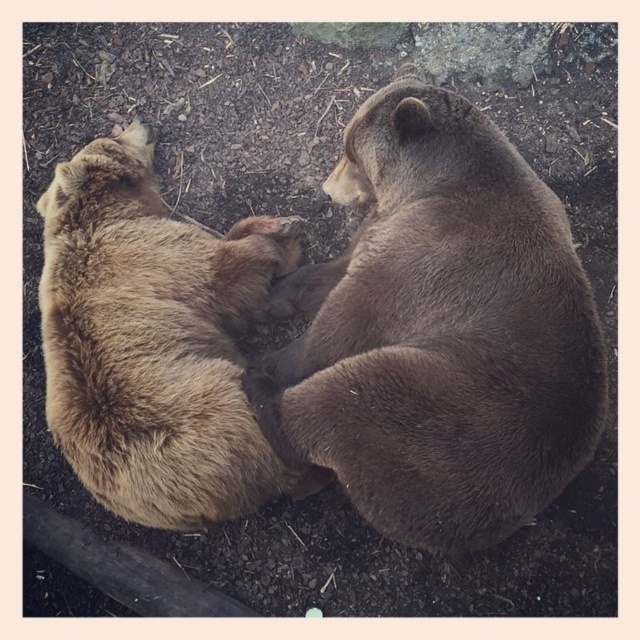
Question: Is brown furry bear at center thinner than fuzzy brown bear at center?

Choices:
 (A) no
 (B) yes

Answer: (B)

Question: Among these points, which one is farthest from the camera?

Choices:
 (A) (120, 144)
 (B) (534, 454)

Answer: (A)

Question: Can you confirm if brown furry bear at center is positioned above fuzzy brown bear at center?

Choices:
 (A) yes
 (B) no

Answer: (B)

Question: Which of the following is the farthest from the observer?

Choices:
 (A) (310, 397)
 (B) (113, 336)

Answer: (B)

Question: Can you confirm if brown furry bear at center is positioned below fuzzy brown bear at center?

Choices:
 (A) no
 (B) yes

Answer: (B)